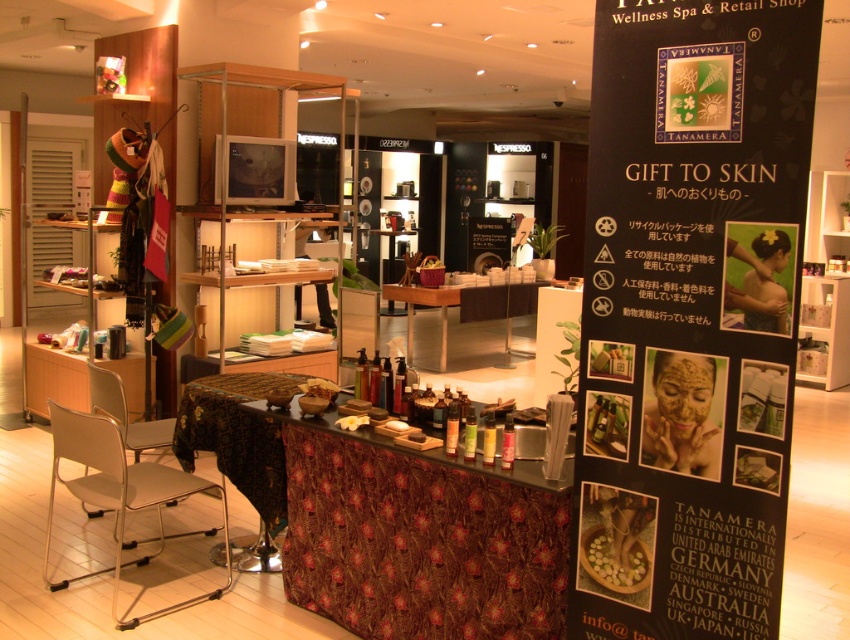
You are standing in the wellness spa and need to place a large vase on the wooden table at center. Given that the table has a surface area of 1.2 square meters, can you confirm if the vase, which occupies 0.3 square meters, will fit on the table?

The wooden table at center has a surface area of 1.2 square meters, and the vase occupies 0.3 square meters. Since 0.3 is less than 1.2, the vase will fit on the table.

You are standing in front of the counter at Tanamera spa. There are two points marked on the counter. One is at coordinate point (533,557) and the other is at point (507,304). Which point is closer to you?

Point (533,557) is closer to the viewer than point (507,304).

You are a customer entering the spa and need to sit down. You see the wooden table at center and the metallic silver chair at lower left. Which one is higher and can you sit on it?

The wooden table at center is taller than the metallic silver chair at lower left. However, the table is meant for placing items, not sitting. Please use the metallic silver chair at lower left for seating.